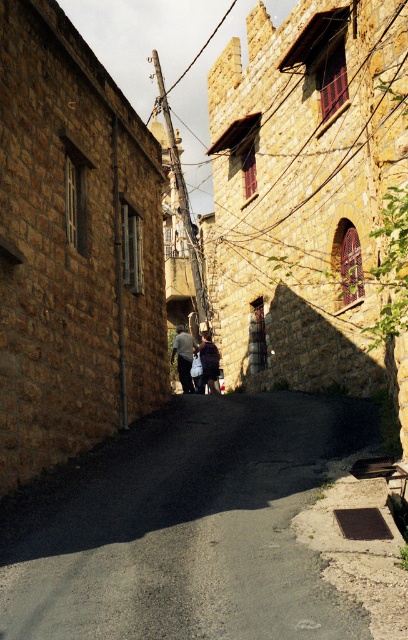
You are a delivery person carrying a large package and need to navigate through the narrow alleyway shown. You see two fabrics hanging from the center of the alleyway. The dark gray fabric at center and the dark blue fabric at center. Which fabric is closer to the left building?

The dark gray fabric at center is positioned on the left side of the dark blue fabric at center, so it is closer to the left building.

You are standing in the narrow alleyway between the two stone buildings. You notice a specific point marked at coordinates (184, 528). What is located at that point?

The point at coordinates (184, 528) marks asphalt at center.

You are a delivery person with a cart that needs to navigate through the alleyway. The cart requires a minimum of 12 meters of space between the asphalt at center and the dark blue fabric at center to pass safely. Can your cart safely navigate this section of the alleyway?

The asphalt at center is 12.80 meters from the dark blue fabric at center, which is more than the required 12 meters, so the cart can safely navigate this section of the alleyway.